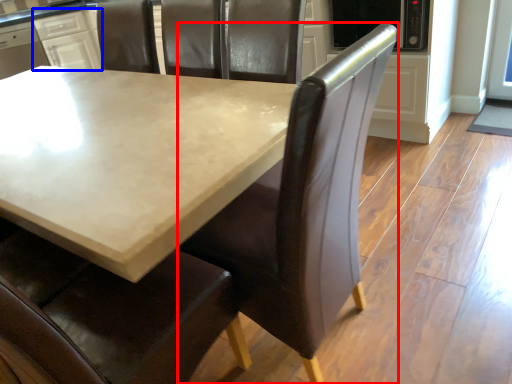
Question: Which of the following is the farthest to the observer, chair (highlighted by a red box) or cabinetry (highlighted by a blue box)?

Choices:
 (A) chair
 (B) cabinetry

Answer: (B)